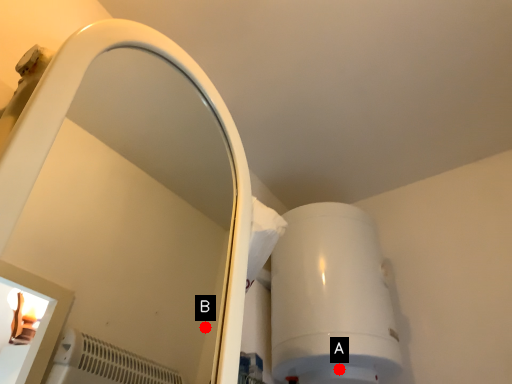
Question: Two points are circled on the image, labeled by A and B beside each circle. Which of the following is the closest to the observer?

Choices:
 (A) A is closer
 (B) B is closer

Answer: (A)